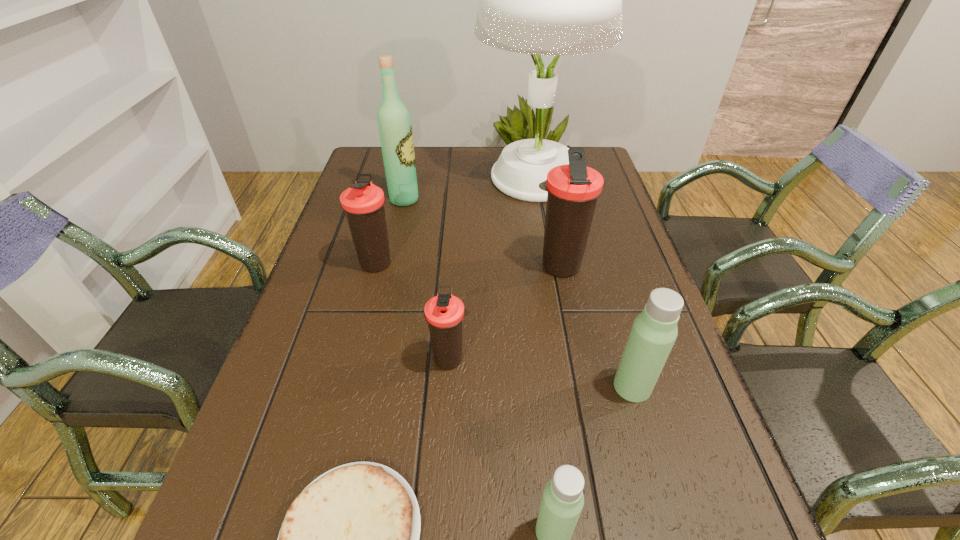
Identify the location of object present at the far edge. (556, 0).

Image resolution: width=960 pixels, height=540 pixels. What are the coordinates of `wine bottle that is at the left edge` in the screenshot? It's located at (395, 129).

In order to click on thermos bottle present at the left edge in this screenshot , I will do `click(363, 202)`.

This screenshot has height=540, width=960. I want to click on lamp at the right edge, so click(556, 0).

Where is `object situated at the far right corner`? This screenshot has height=540, width=960. object situated at the far right corner is located at coordinates (556, 0).

Where is `free location at the far edge`? This screenshot has height=540, width=960. free location at the far edge is located at coordinates (465, 152).

In the image, there is a desktop. Find the location of `vacant space at the left edge`. vacant space at the left edge is located at coordinates (318, 354).

Locate an element on the screen. Image resolution: width=960 pixels, height=540 pixels. vacant space at the right edge of the desktop is located at coordinates (684, 420).

Where is `blank region between the nearest brown thermos bottle and the rightmost brown thermos bottle`? The image size is (960, 540). blank region between the nearest brown thermos bottle and the rightmost brown thermos bottle is located at coordinates (504, 312).

Where is `vacant space that's between the wine bottle and the second brown thermos bottle from left to right`? Image resolution: width=960 pixels, height=540 pixels. vacant space that's between the wine bottle and the second brown thermos bottle from left to right is located at coordinates click(427, 279).